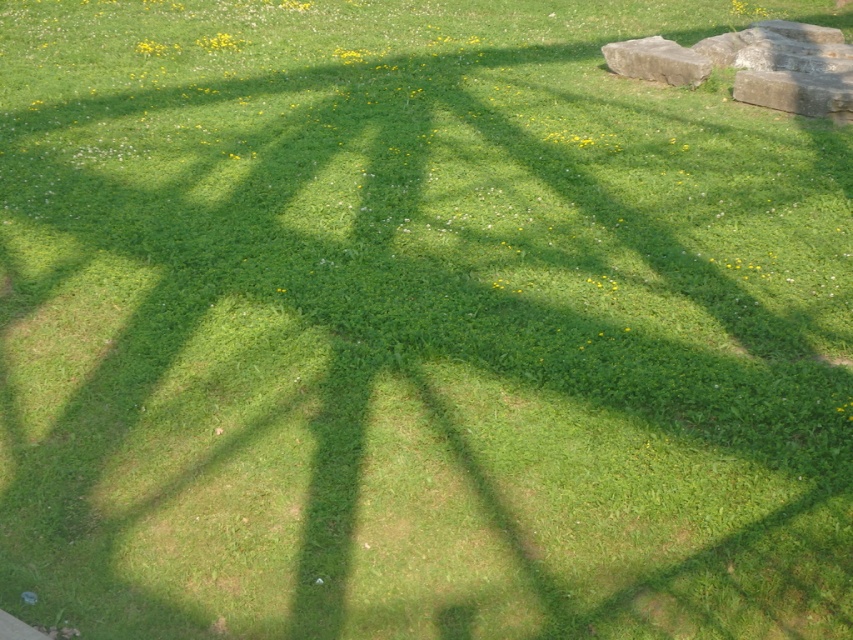
Can you confirm if gray stone at upper right is smaller than gray rough stone at upper right?

Indeed, gray stone at upper right has a smaller size compared to gray rough stone at upper right.

Which of these two, gray stone at upper right or gray rough stone at upper right, stands taller?

gray rough stone at upper right

What do you see at coordinates (798, 92) in the screenshot? I see `gray stone at upper right` at bounding box center [798, 92].

Find the location of a particular element. The height and width of the screenshot is (640, 853). gray stone at upper right is located at coordinates (798, 92).